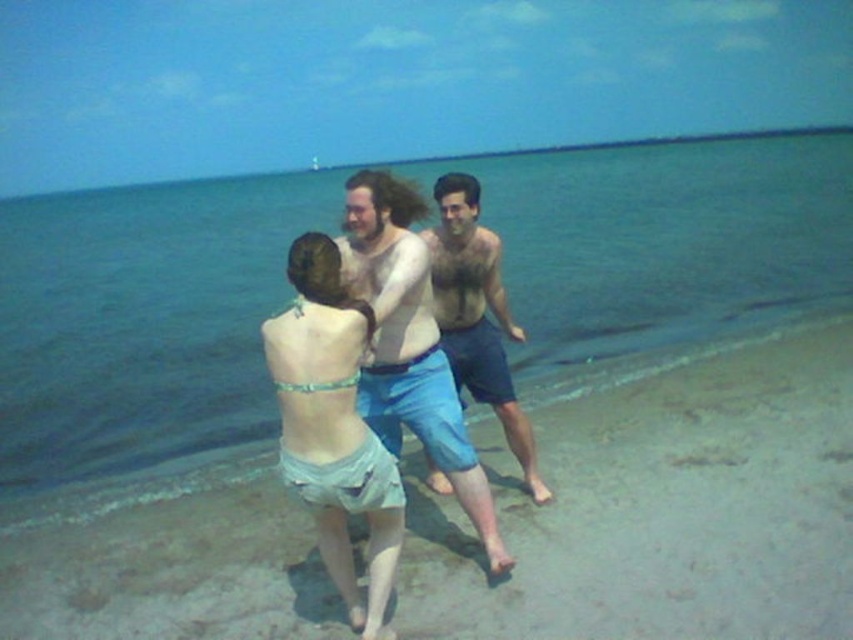
You are a photographer taking a picture of the beach scene. You notice the shiny blue shorts at center and the muscular tan skin at center. Which object is positioned lower in the image?

The shiny blue shorts at center is below muscular tan skin at center, so the shiny blue shorts at center is positioned lower in the image.

You are a photographer taking a picture of the beach scene. You notice the light blue fabric bikini top at center and the shiny blue shorts at center. Which one is positioned to the left of the other?

The light blue fabric bikini top at center is to the left of the shiny blue shorts at center.

You are a photographer standing at the shoreline. You want to take a photo of the light blue fabric bikini top at center and the shiny blue shorts at center. If your camera can focus on objects within 15 inches, will both items be in focus?

The light blue fabric bikini top at center is 17.02 inches away from the shiny blue shorts at center, so the distance between them exceeds the camera focus range of 15 inches. Therefore, both items cannot be in focus simultaneously.